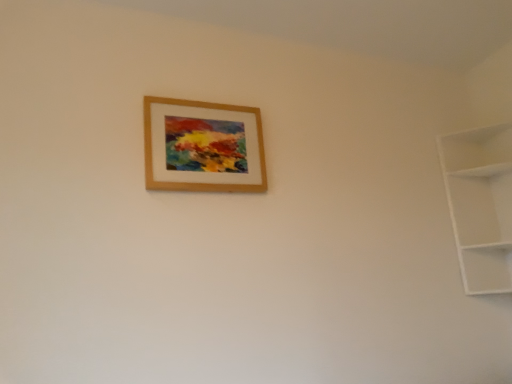
Question: Can you confirm if white matte shelf at right is positioned to the right of wooden picture frame at upper center?

Choices:
 (A) yes
 (B) no

Answer: (A)

Question: From the image's perspective, is white matte shelf at right on top of wooden picture frame at upper center?

Choices:
 (A) yes
 (B) no

Answer: (B)

Question: Is wooden picture frame at upper center located within white matte shelf at right?

Choices:
 (A) yes
 (B) no

Answer: (B)

Question: Does white matte shelf at right have a lesser height compared to wooden picture frame at upper center?

Choices:
 (A) no
 (B) yes

Answer: (A)

Question: From the image's perspective, does white matte shelf at right appear lower than wooden picture frame at upper center?

Choices:
 (A) yes
 (B) no

Answer: (A)

Question: Are white matte shelf at right and wooden picture frame at upper center far apart?

Choices:
 (A) yes
 (B) no

Answer: (A)

Question: Is there a large distance between wooden picture frame at upper center and white matte shelf at right?

Choices:
 (A) no
 (B) yes

Answer: (B)

Question: Is wooden picture frame at upper center behind white matte shelf at right?

Choices:
 (A) no
 (B) yes

Answer: (A)

Question: Considering the relative sizes of wooden picture frame at upper center and white matte shelf at right in the image provided, is wooden picture frame at upper center thinner than white matte shelf at right?

Choices:
 (A) no
 (B) yes

Answer: (B)

Question: Is wooden picture frame at upper center facing towards white matte shelf at right?

Choices:
 (A) yes
 (B) no

Answer: (B)

Question: Does wooden picture frame at upper center have a greater height compared to white matte shelf at right?

Choices:
 (A) yes
 (B) no

Answer: (B)

Question: Considering the relative positions of wooden picture frame at upper center and white matte shelf at right in the image provided, is wooden picture frame at upper center in front of white matte shelf at right?

Choices:
 (A) no
 (B) yes

Answer: (B)

Question: Considering their positions, is white matte shelf at right located in front of or behind wooden picture frame at upper center?

Choices:
 (A) front
 (B) behind

Answer: (B)